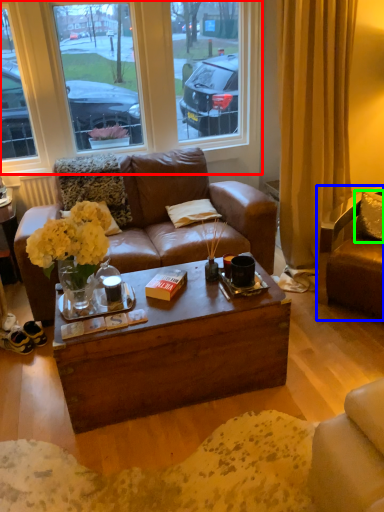
Question: Which object is positioned closest to window (highlighted by a red box)? Select from chair (highlighted by a blue box) and pillow (highlighted by a green box).

Choices:
 (A) chair
 (B) pillow

Answer: (B)